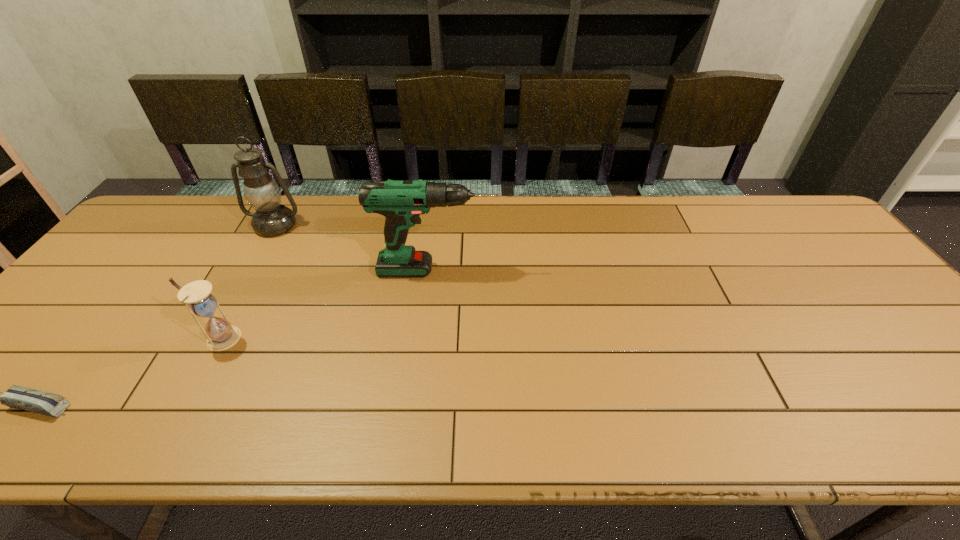
Identify which object is the closest to the shortest object. Please provide its 2D coordinates. Your answer should be formatted as a tuple, i.e. [(x, y)], where the tuple contains the x and y coordinates of a point satisfying the conditions above.

[(197, 296)]

Locate an element on the screen. object that stands as the third closest to the oil lamp is located at coordinates (51, 404).

This screenshot has width=960, height=540. I want to click on vacant space that satisfies the following two spatial constraints: 1. on the handle side of the third nearest object; 2. on the front side of the third farthest object, so click(x=429, y=338).

Where is `free location that satisfies the following two spatial constraints: 1. on the handle side of the rightmost object; 2. on the front side of the third tallest object`? This screenshot has height=540, width=960. free location that satisfies the following two spatial constraints: 1. on the handle side of the rightmost object; 2. on the front side of the third tallest object is located at coordinates (429, 338).